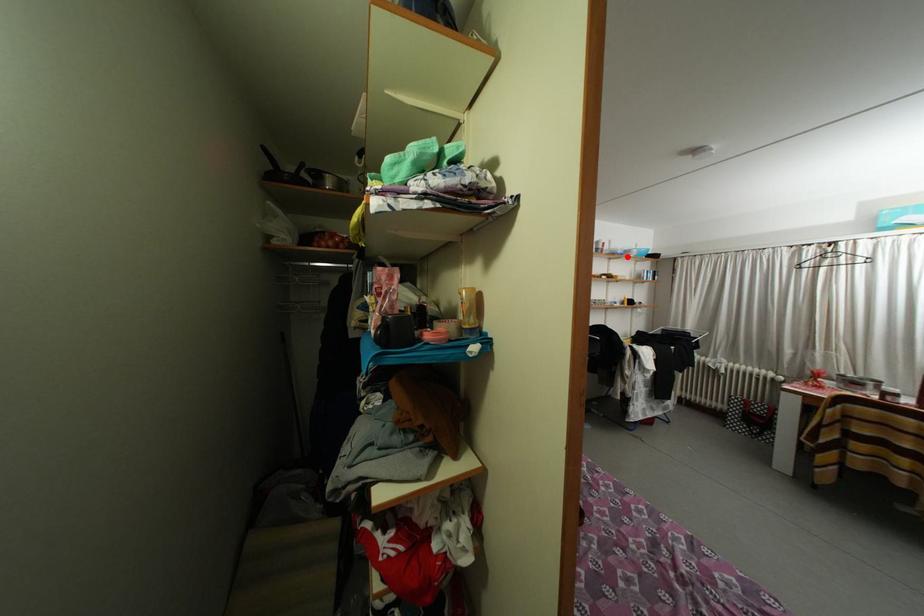
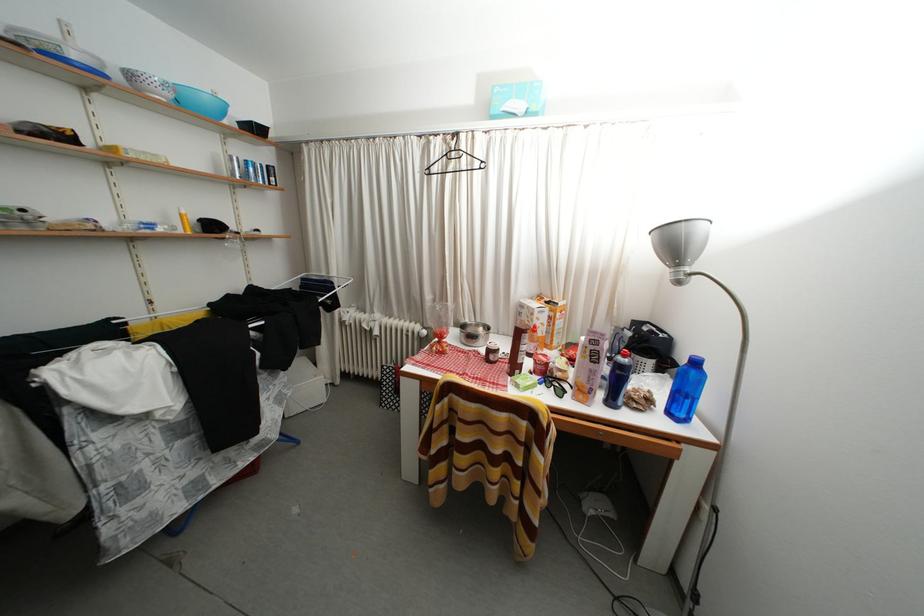
Question: I am providing you with two images of the same scene from different viewpoints. A red point is marked on the first image. At the location where the point appears in image 1, is it still visible in image 2?

Choices:
 (A) Yes
 (B) No

Answer: (A)